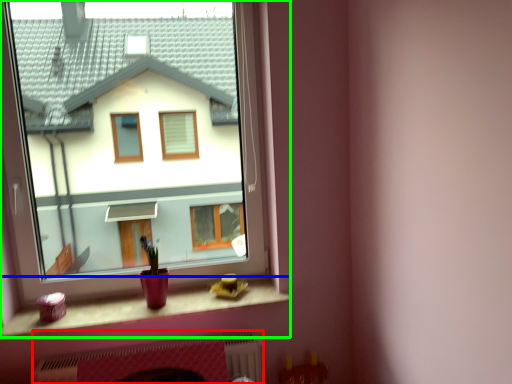
Question: Which object is positioned closest to fireplace (highlighted by a red box)? Select from window sill (highlighted by a blue box) and window (highlighted by a green box).

Choices:
 (A) window sill
 (B) window

Answer: (A)